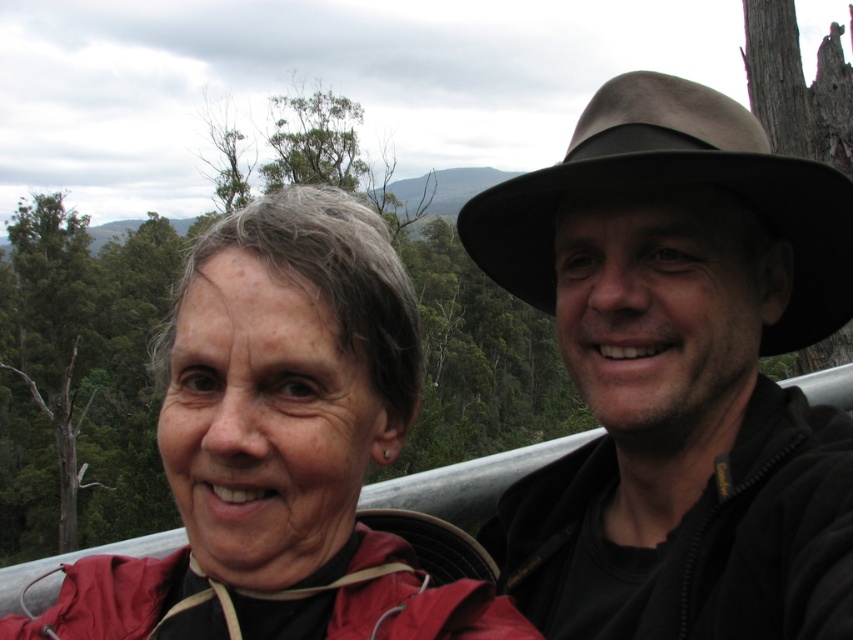
Question: Which of the following is the farthest from the observer?

Choices:
 (A) brown felt cowboy hat at upper right
 (B) matte red jacket at left

Answer: (A)

Question: Which of the following is the closest to the observer?

Choices:
 (A) (764, 131)
 (B) (265, 307)

Answer: (B)

Question: Does matte red jacket at left have a greater width compared to brown felt cowboy hat at upper right?

Choices:
 (A) yes
 (B) no

Answer: (B)

Question: Does matte red jacket at left have a greater width compared to brown felt cowboy hat at upper right?

Choices:
 (A) no
 (B) yes

Answer: (A)

Question: Considering the relative positions of matte red jacket at left and brown felt cowboy hat at upper right in the image provided, where is matte red jacket at left located with respect to brown felt cowboy hat at upper right?

Choices:
 (A) above
 (B) below

Answer: (B)